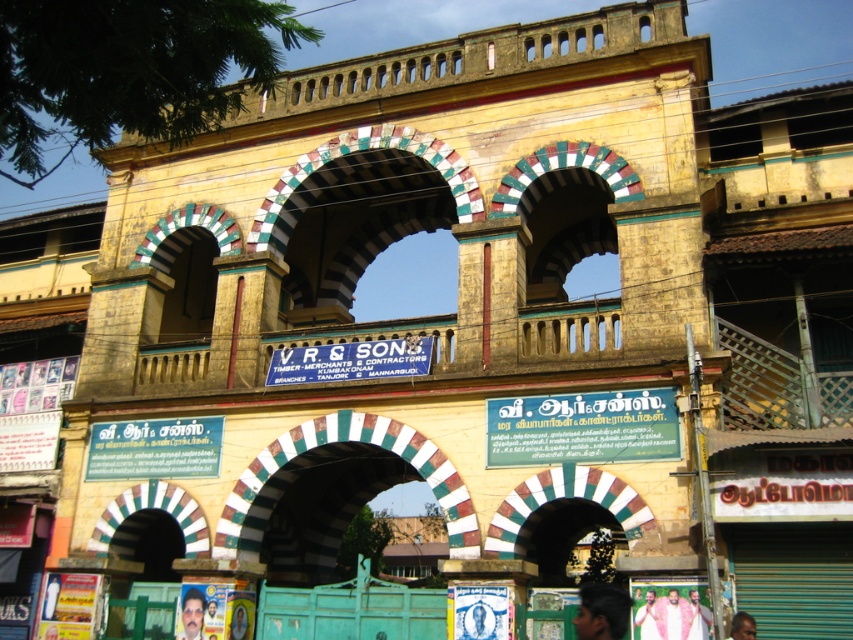
Question: Which point is farther to the camera?

Choices:
 (A) white painted stone archway at center
 (B) light brown wooden frame at center

Answer: (B)

Question: Which object is farther from the camera taking this photo?

Choices:
 (A) smooth skin face at center
 (B) white clothed person at center

Answer: (A)

Question: Does white painted stone archway at center have a smaller size compared to light brown skin at lower center?

Choices:
 (A) yes
 (B) no

Answer: (B)

Question: Does light brown wooden frame at center have a lesser width compared to smooth skin face at center?

Choices:
 (A) yes
 (B) no

Answer: (A)

Question: Is light pink fabric at center above white clothed person at center?

Choices:
 (A) no
 (B) yes

Answer: (A)

Question: Which point appears closest to the camera in this image?

Choices:
 (A) (654, 592)
 (B) (683, 637)
 (C) (216, 538)
 (D) (740, 621)

Answer: (D)